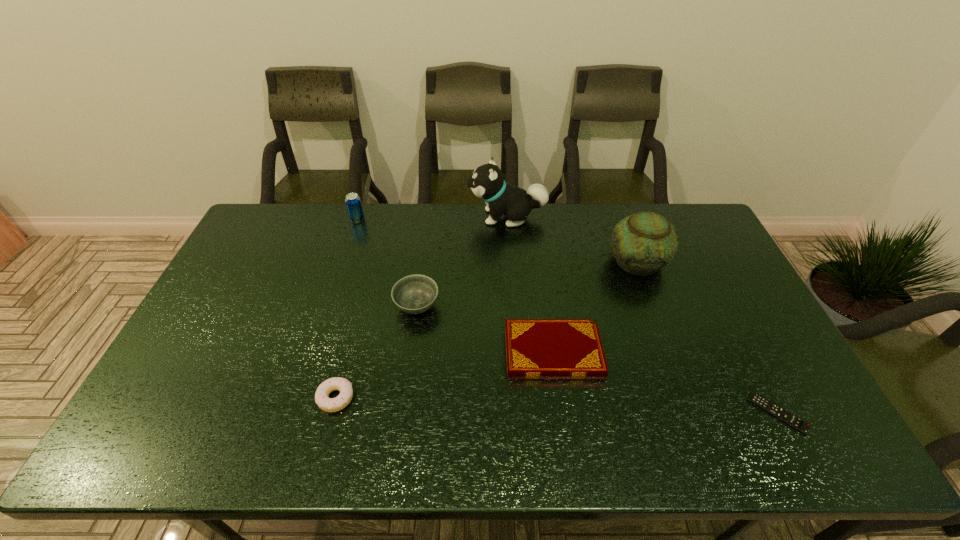
Identify the location of remote control. Image resolution: width=960 pixels, height=540 pixels. (776, 411).

Where is `free spot located 0.340m at the face of the puppy`? Image resolution: width=960 pixels, height=540 pixels. free spot located 0.340m at the face of the puppy is located at coordinates (376, 217).

Find the location of a particular element. This screenshot has height=540, width=960. free space located at the face of the puppy is located at coordinates (406, 217).

Identify the location of vacant region located 0.070m at the face of the puppy. The height and width of the screenshot is (540, 960). (448, 217).

I want to click on vacant area situated 0.200m on the back of the sixth object from left to right, so click(617, 208).

The height and width of the screenshot is (540, 960). What are the coordinates of `free spot located on the right of the fifth shortest object` in the screenshot? It's located at (405, 219).

In order to click on free space located on the front of the bowl in this screenshot , I will do `click(409, 364)`.

The width and height of the screenshot is (960, 540). I want to click on free space located 0.260m on the cover of the third nearest object, so click(x=412, y=353).

You are a GUI agent. You are given a task and a screenshot of the screen. Output one action in this format:
    pyautogui.click(x=<x>, y=<y>)
    Task: Click on the vacant space located on the cover of the third nearest object
    
    Given the screenshot: What is the action you would take?
    pyautogui.click(x=469, y=353)

Locate an element on the screen. This screenshot has width=960, height=540. free space located on the cover of the third nearest object is located at coordinates (437, 353).